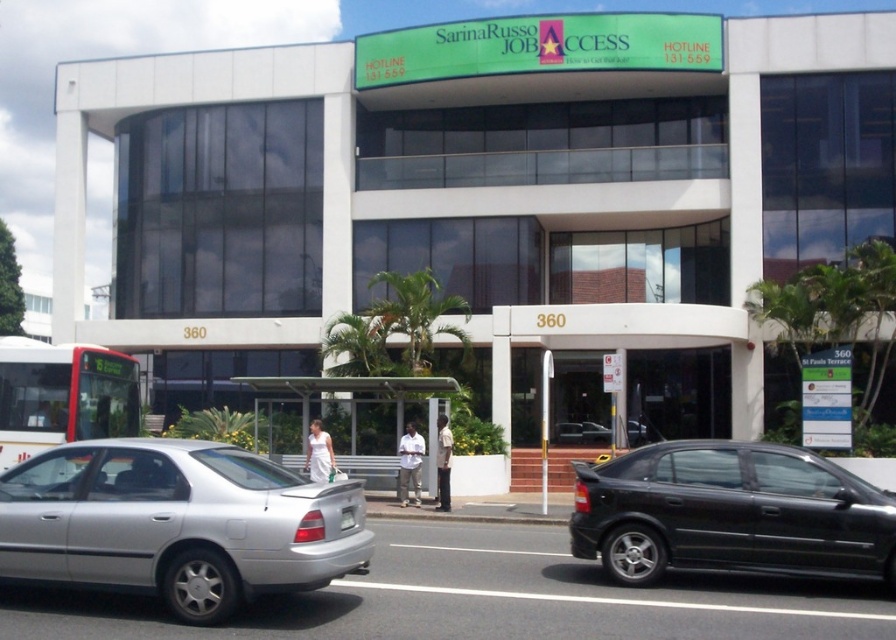
Question: Does silver metallic sedan at lower left have a lesser width compared to white matte bus at left?

Choices:
 (A) yes
 (B) no

Answer: (A)

Question: Can you confirm if black glossy sedan at lower right is positioned above white matte bus at left?

Choices:
 (A) no
 (B) yes

Answer: (A)

Question: Is silver metallic sedan at lower left behind white matte bus at left?

Choices:
 (A) no
 (B) yes

Answer: (A)

Question: Which point is closer to the camera taking this photo?

Choices:
 (A) (573, 513)
 (B) (85, 369)
 (C) (185, 490)

Answer: (C)

Question: Which point is closer to the camera?

Choices:
 (A) white matte bus at left
 (B) black glossy sedan at lower right
 (C) silver metallic sedan at lower left

Answer: (C)

Question: Which point is closer to the camera?

Choices:
 (A) (73, 560)
 (B) (82, 352)
 (C) (677, 532)

Answer: (A)